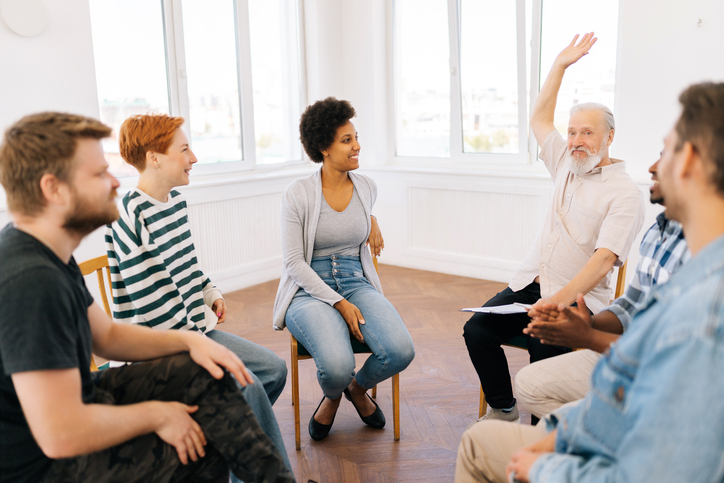
The width and height of the screenshot is (724, 483). What are the coordinates of `window` in the screenshot? It's located at (111, 37), (226, 71), (279, 78), (426, 73), (487, 73), (589, 21).